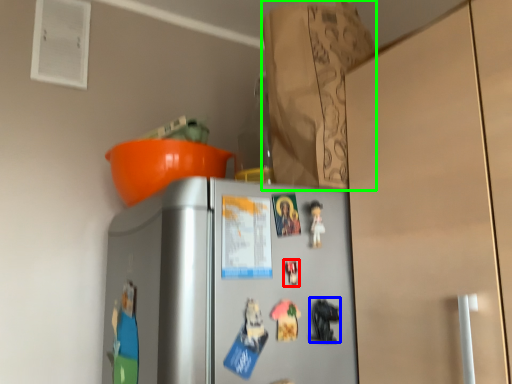
Question: Estimate the real-world distances between objects in this image. Which object is closer to toy (highlighted by a red box), toy (highlighted by a blue box) or paper bag (highlighted by a green box)?

Choices:
 (A) toy
 (B) paper bag

Answer: (A)